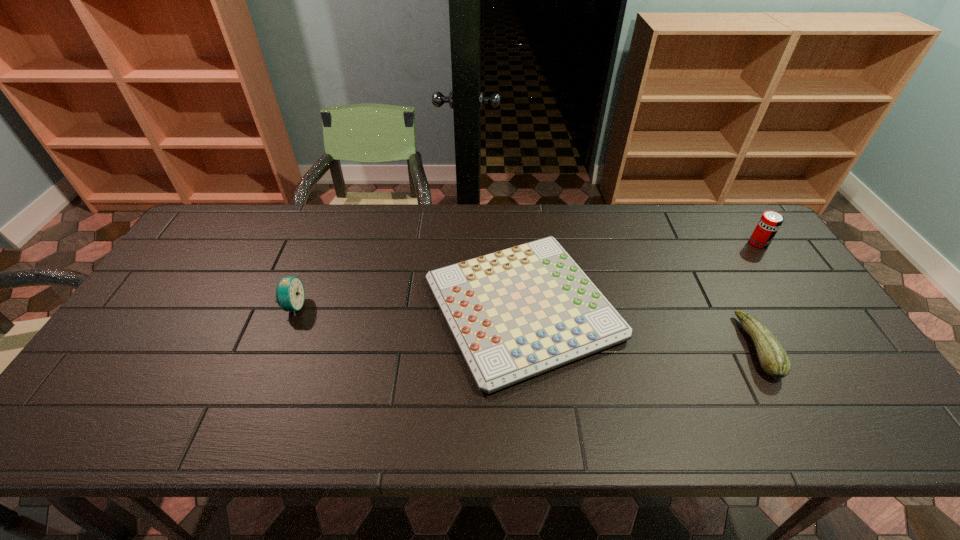
Find the location of a particular element. This screenshot has width=960, height=540. can is located at coordinates (770, 222).

The width and height of the screenshot is (960, 540). In order to click on the leftmost object in this screenshot , I will do `click(290, 294)`.

In order to click on the third object from left to right in this screenshot , I will do `click(773, 358)`.

This screenshot has width=960, height=540. I want to click on zucchini, so click(773, 358).

The image size is (960, 540). Find the location of `gameboard`. gameboard is located at coordinates (516, 313).

The width and height of the screenshot is (960, 540). What are the coordinates of `the shortest object` in the screenshot? It's located at (516, 313).

You are a GUI agent. You are given a task and a screenshot of the screen. Output one action in this format:
    pyautogui.click(x=<x>, y=<y>)
    Task: Click on the free spot located on the left of the rightmost object
    The width and height of the screenshot is (960, 540).
    Given the screenshot: What is the action you would take?
    pyautogui.click(x=668, y=243)

At what (x,y) coordinates should I click in order to perform the action: click on vacant region located on the front-facing side of the leftmost object. Please return your answer as a coordinate pair (x, y). This screenshot has height=540, width=960. Looking at the image, I should click on (417, 306).

This screenshot has width=960, height=540. In order to click on vacant space situated 0.050m at the stem end of the second object from right to left in this screenshot , I will do `click(726, 347)`.

Locate an element on the screen. This screenshot has height=540, width=960. free space located 0.230m at the stem end of the second object from right to left is located at coordinates (655, 347).